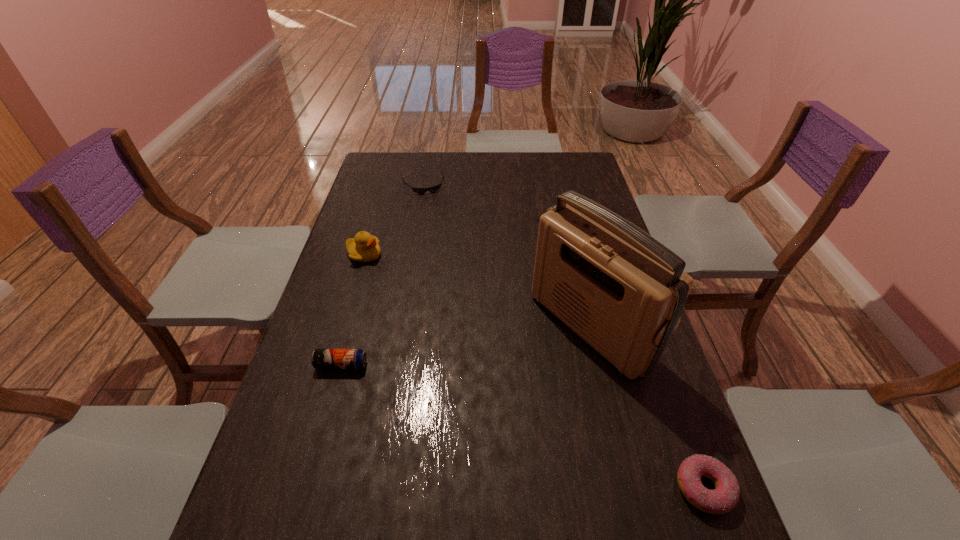
Locate an element on the screen. vacant space located 0.190m on the front-facing side of the second tallest object is located at coordinates (398, 301).

Locate an element on the screen. This screenshot has height=540, width=960. free point located on the front-facing side of the second tallest object is located at coordinates [x=384, y=281].

Where is `free point located 0.360m on the front-facing side of the radio receiver`? Image resolution: width=960 pixels, height=540 pixels. free point located 0.360m on the front-facing side of the radio receiver is located at coordinates (427, 444).

The image size is (960, 540). Find the location of `free space located 0.360m on the front-facing side of the radio receiver`. free space located 0.360m on the front-facing side of the radio receiver is located at coordinates (427, 444).

Identify the location of vacant space located on the front-facing side of the radio receiver. This screenshot has width=960, height=540. (443, 434).

Locate an element on the screen. This screenshot has width=960, height=540. vacant area situated 0.380m on the front-facing side of the shortest object is located at coordinates (450, 258).

This screenshot has height=540, width=960. Find the location of `free space located 0.200m on the front-facing side of the shortest object`. free space located 0.200m on the front-facing side of the shortest object is located at coordinates pos(438,225).

Find the location of a particular element. The width and height of the screenshot is (960, 540). vacant space located on the front-facing side of the shortest object is located at coordinates (448, 253).

Find the location of `object present at the far edge`. object present at the far edge is located at coordinates (432, 189).

You are a GUI agent. You are given a task and a screenshot of the screen. Output one action in this format:
    pyautogui.click(x=<x>, y=<y>)
    Task: Click on the object at the near edge
    
    Given the screenshot: What is the action you would take?
    pyautogui.click(x=725, y=496)